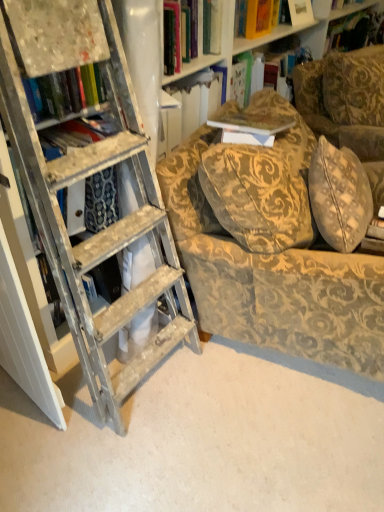
Question: Are hardcover book at upper center and gold-patterned fabric chair at center located far from each other?

Choices:
 (A) no
 (B) yes

Answer: (B)

Question: Is hardcover book at upper center turned away from gold-patterned fabric chair at center?

Choices:
 (A) yes
 (B) no

Answer: (B)

Question: Is the depth of hardcover book at upper center greater than that of gold-patterned fabric chair at center?

Choices:
 (A) yes
 (B) no

Answer: (A)

Question: From a real-world perspective, is hardcover book at upper center beneath gold-patterned fabric chair at center?

Choices:
 (A) no
 (B) yes

Answer: (A)

Question: From the image's perspective, is hardcover book at upper center located beneath gold-patterned fabric chair at center?

Choices:
 (A) no
 (B) yes

Answer: (A)

Question: Is hardcover book at upper center closer to camera compared to gold-patterned fabric chair at center?

Choices:
 (A) yes
 (B) no

Answer: (B)

Question: Is gold-patterned fabric chair at center to the left of hardcover book at upper center from the viewer's perspective?

Choices:
 (A) yes
 (B) no

Answer: (A)

Question: From a real-world perspective, does gold-patterned fabric chair at center sit lower than hardcover book at upper center?

Choices:
 (A) no
 (B) yes

Answer: (B)

Question: From the image's perspective, is gold-patterned fabric chair at center over hardcover book at upper center?

Choices:
 (A) no
 (B) yes

Answer: (A)

Question: Considering the relative sizes of gold-patterned fabric chair at center and hardcover book at upper center in the image provided, is gold-patterned fabric chair at center thinner than hardcover book at upper center?

Choices:
 (A) yes
 (B) no

Answer: (B)

Question: Is gold-patterned fabric chair at center in front of hardcover book at upper center?

Choices:
 (A) yes
 (B) no

Answer: (A)

Question: Is gold-patterned fabric chair at center directly adjacent to hardcover book at upper center?

Choices:
 (A) yes
 (B) no

Answer: (B)

Question: From their relative heights in the image, would you say hardcover book at upper center is taller or shorter than gold-patterned fabric chair at center?

Choices:
 (A) tall
 (B) short

Answer: (B)